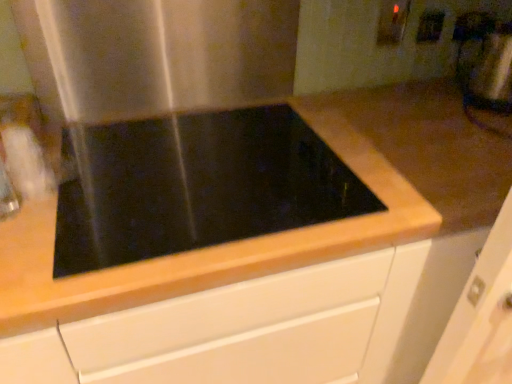
Question: Is metallic silver blender at upper right thinner than black glass cooktop at center?

Choices:
 (A) no
 (B) yes

Answer: (B)

Question: Does metallic silver blender at upper right appear on the left side of black glass cooktop at center?

Choices:
 (A) yes
 (B) no

Answer: (B)

Question: Can you confirm if metallic silver blender at upper right is shorter than black glass cooktop at center?

Choices:
 (A) no
 (B) yes

Answer: (A)

Question: Are metallic silver blender at upper right and black glass cooktop at center making contact?

Choices:
 (A) yes
 (B) no

Answer: (B)

Question: Does metallic silver blender at upper right have a greater width compared to black glass cooktop at center?

Choices:
 (A) yes
 (B) no

Answer: (B)

Question: From a real-world perspective, is matte white electric outlet at upper right, which is the 2th electric outlet from right to left, positioned above or below stainless steel at upper left?

Choices:
 (A) below
 (B) above

Answer: (B)

Question: Is matte white electric outlet at upper right, which is the 1th electric outlet from left to right, taller or shorter than stainless steel at upper left?

Choices:
 (A) tall
 (B) short

Answer: (B)

Question: Does point (384, 34) appear closer or farther from the camera than point (205, 61)?

Choices:
 (A) closer
 (B) farther

Answer: (B)

Question: Based on their positions, is matte white electric outlet at upper right, which is the 2th electric outlet from right to left, located to the left or right of stainless steel at upper left?

Choices:
 (A) left
 (B) right

Answer: (B)

Question: Which is correct: stainless steel at upper left is inside metallic silver blender at upper right, or outside of it?

Choices:
 (A) outside
 (B) inside

Answer: (A)

Question: In terms of size, does stainless steel at upper left appear bigger or smaller than metallic silver blender at upper right?

Choices:
 (A) small
 (B) big

Answer: (A)

Question: In the image, is stainless steel at upper left positioned in front of or behind metallic silver blender at upper right?

Choices:
 (A) behind
 (B) front

Answer: (B)

Question: From a real-world perspective, is stainless steel at upper left positioned above or below metallic silver blender at upper right?

Choices:
 (A) below
 (B) above

Answer: (B)

Question: From the image's perspective, is matte white electric outlet at upper right, which is the 2th electric outlet from right to left, above or below black glass cooktop at center?

Choices:
 (A) below
 (B) above

Answer: (B)

Question: In terms of width, does matte white electric outlet at upper right, which is the 2th electric outlet from right to left, look wider or thinner when compared to black glass cooktop at center?

Choices:
 (A) wide
 (B) thin

Answer: (B)